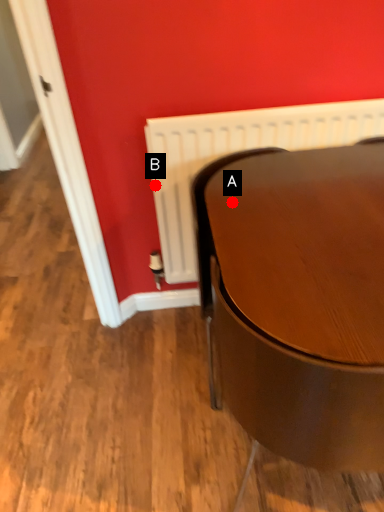
Question: Two points are circled on the image, labeled by A and B beside each circle. Which point is closer to the camera?

Choices:
 (A) A is closer
 (B) B is closer

Answer: (A)